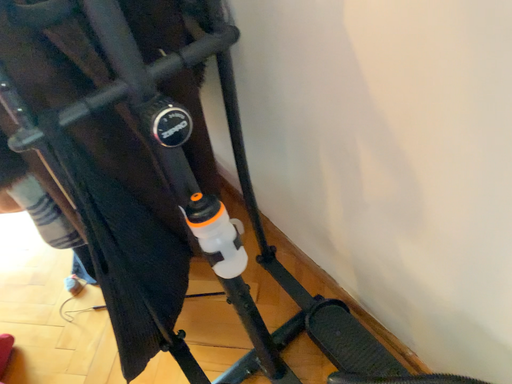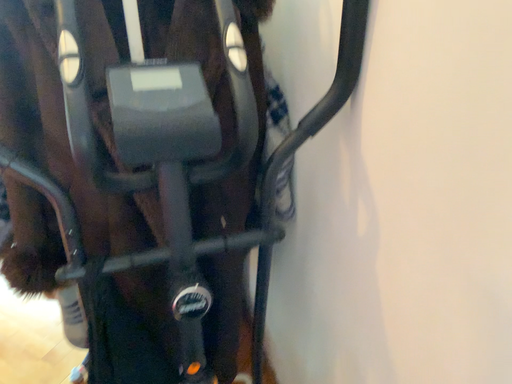
Question: How did the camera likely rotate when shooting the video?

Choices:
 (A) rotated left
 (B) rotated right

Answer: (A)